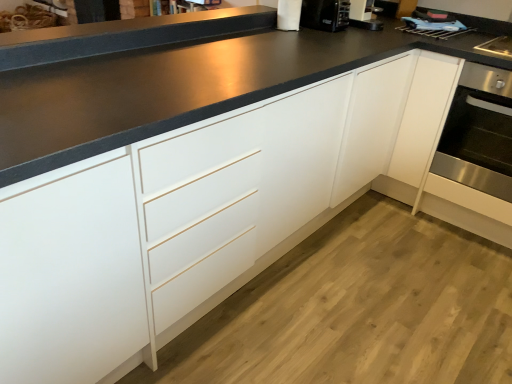
This screenshot has height=384, width=512. Describe the element at coordinates (289, 15) in the screenshot. I see `white paper towel at upper center` at that location.

Find the location of a particular element. The height and width of the screenshot is (384, 512). black plastic coffee machine at upper right is located at coordinates (325, 14).

What do you see at coordinates (125, 35) in the screenshot? Image resolution: width=512 pixels, height=384 pixels. I see `black matte countertop at upper center` at bounding box center [125, 35].

Locate an element on the screen. white paper towel at upper center is located at coordinates (289, 15).

Is black matte countertop at upper center located within white paper towel at upper center?

No, black matte countertop at upper center is not surrounded by white paper towel at upper center.

Who is bigger, white paper towel at upper center or black matte countertop at upper center?

black matte countertop at upper center is bigger.

Measure the distance between white paper towel at upper center and black matte countertop at upper center.

19.69 inches.

Relative to black matte countertop at upper center, is white paper towel at upper center in front or behind?

Clearly, white paper towel at upper center is behind black matte countertop at upper center.

Considering the relative sizes of stainless steel oven at right and white paper towel at upper center in the image provided, is stainless steel oven at right wider than white paper towel at upper center?

Correct, the width of stainless steel oven at right exceeds that of white paper towel at upper center.

Considering the positions of objects stainless steel oven at right and white paper towel at upper center in the image provided, who is more to the right, stainless steel oven at right or white paper towel at upper center?

stainless steel oven at right is more to the right.

Is stainless steel oven at right next to white paper towel at upper center?

stainless steel oven at right is not next to white paper towel at upper center, and they're not touching.

Considering the points (482, 98) and (283, 8), which point is in front, point (482, 98) or point (283, 8)?

The point (482, 98) is closer to the camera.

Which is more distant, (463, 116) or (342, 30)?

The point (463, 116) is farther.

From the image's perspective, which is below, stainless steel oven at right or black plastic coffee machine at upper right?

From the image's view, stainless steel oven at right is below.

From the picture: Is stainless steel oven at right bigger than black plastic coffee machine at upper right?

Yes.

In the scene shown: How far apart are stainless steel oven at right and black plastic coffee machine at upper right?

stainless steel oven at right and black plastic coffee machine at upper right are 34.86 inches apart from each other.

Is white paper towel at upper center far from black plastic coffee machine at upper right?

No.

At what (x,y) coordinates should I click in order to perform the action: click on appliance above the black plastic coffee machine at upper right (from a real-world perspective). Please return your answer as a coordinate pair (x, y). This screenshot has width=512, height=384. Looking at the image, I should click on (289, 15).

From the image's perspective, which object appears higher, white paper towel at upper center or black plastic coffee machine at upper right?

From the image's view, white paper towel at upper center is above.

Which object is positioned more to the right, stainless steel oven at right or black matte countertop at upper center?

stainless steel oven at right is more to the right.

Is black matte countertop at upper center at the back of stainless steel oven at right?

That's not correct — stainless steel oven at right is not looking away from black matte countertop at upper center.

From the image's perspective, which is above, stainless steel oven at right or black matte countertop at upper center?

black matte countertop at upper center appears higher in the image.

From a real-world perspective, is stainless steel oven at right on top of black matte countertop at upper center?

No, from a real-world perspective, stainless steel oven at right is not over black matte countertop at upper center

Considering the relative sizes of black plastic coffee machine at upper right and white paper towel at upper center in the image provided, is black plastic coffee machine at upper right bigger than white paper towel at upper center?

Yes.

Between black plastic coffee machine at upper right and white paper towel at upper center, which one has larger width?

black plastic coffee machine at upper right.

From the image's perspective, between black plastic coffee machine at upper right and white paper towel at upper center, which one is located above?

white paper towel at upper center is shown above in the image.

Is point (313, 15) positioned behind point (288, 30)?

Yes, point (313, 15) is behind point (288, 30).

Can we say white paper towel at upper center lies outside stainless steel oven at right?

Yes, white paper towel at upper center is outside of stainless steel oven at right.

Is white paper towel at upper center to the right of stainless steel oven at right from the viewer's perspective?

No, white paper towel at upper center is not to the right of stainless steel oven at right.

Locate an element on the screen. oven below the white paper towel at upper center (from a real-world perspective) is located at coordinates click(x=477, y=146).

How far apart are white paper towel at upper center and stainless steel oven at right?

white paper towel at upper center is 1.07 meters from stainless steel oven at right.

At what (x,y) coordinates should I click in order to perform the action: click on appliance above the black matte countertop at upper center (from a real-world perspective). Please return your answer as a coordinate pair (x, y). The height and width of the screenshot is (384, 512). Looking at the image, I should click on (289, 15).

This screenshot has width=512, height=384. Identify the location of appliance on the left of stainless steel oven at right. (289, 15).

Based on their spatial positions, is black plastic coffee machine at upper right or stainless steel oven at right closer to black matte countertop at upper center?

black plastic coffee machine at upper right is closer to black matte countertop at upper center.

Looking at this image, estimate the real-world distances between objects in this image. Which object is further from stainless steel oven at right, black matte countertop at upper center or black plastic coffee machine at upper right?

black matte countertop at upper center is further to stainless steel oven at right.

Looking at this image, when comparing their distances from stainless steel oven at right, does white paper towel at upper center or black matte countertop at upper center seem further?

black matte countertop at upper center.

Based on the photo, based on their spatial positions, is black matte countertop at upper center or stainless steel oven at right closer to white paper towel at upper center?

The object closer to white paper towel at upper center is black matte countertop at upper center.

Which object lies further to the anchor point black matte countertop at upper center, stainless steel oven at right or white paper towel at upper center?

Based on the image, stainless steel oven at right appears to be further to black matte countertop at upper center.

When comparing their distances from stainless steel oven at right, does white paper towel at upper center or black plastic coffee machine at upper right seem further?

white paper towel at upper center lies further to stainless steel oven at right than the other object.

Looking at the image, which one is located closer to black matte countertop at upper center, white paper towel at upper center or stainless steel oven at right?

white paper towel at upper center.

Considering their positions, is black plastic coffee machine at upper right positioned further to black matte countertop at upper center than white paper towel at upper center?

The object further to black matte countertop at upper center is black plastic coffee machine at upper right.

Identify the location of coffee machine between black matte countertop at upper center and stainless steel oven at right. (325, 14).

Where is `coffee machine situated between white paper towel at upper center and stainless steel oven at right from left to right`? This screenshot has width=512, height=384. coffee machine situated between white paper towel at upper center and stainless steel oven at right from left to right is located at coordinates (325, 14).

Where is `appliance between black matte countertop at upper center and black plastic coffee machine at upper right along the z-axis`? The width and height of the screenshot is (512, 384). appliance between black matte countertop at upper center and black plastic coffee machine at upper right along the z-axis is located at coordinates (289, 15).

This screenshot has height=384, width=512. Find the location of `appliance between black matte countertop at upper center and stainless steel oven at right`. appliance between black matte countertop at upper center and stainless steel oven at right is located at coordinates (289, 15).